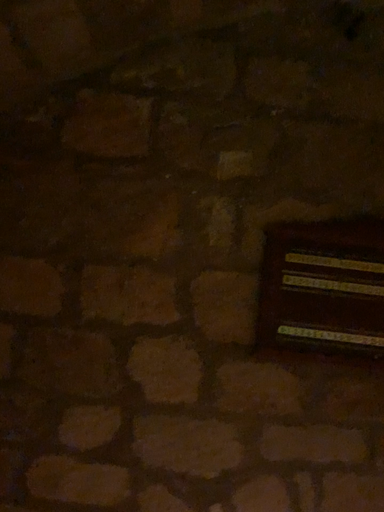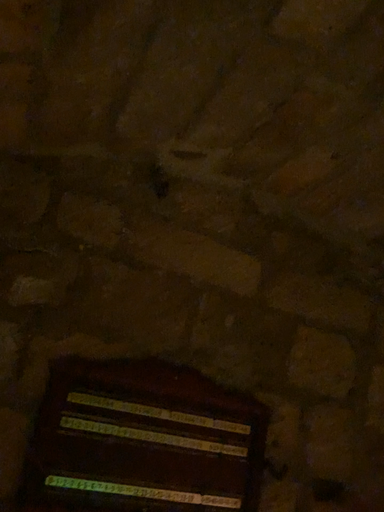
Question: Which way did the camera rotate in the video?

Choices:
 (A) rotated upward
 (B) rotated downward

Answer: (A)